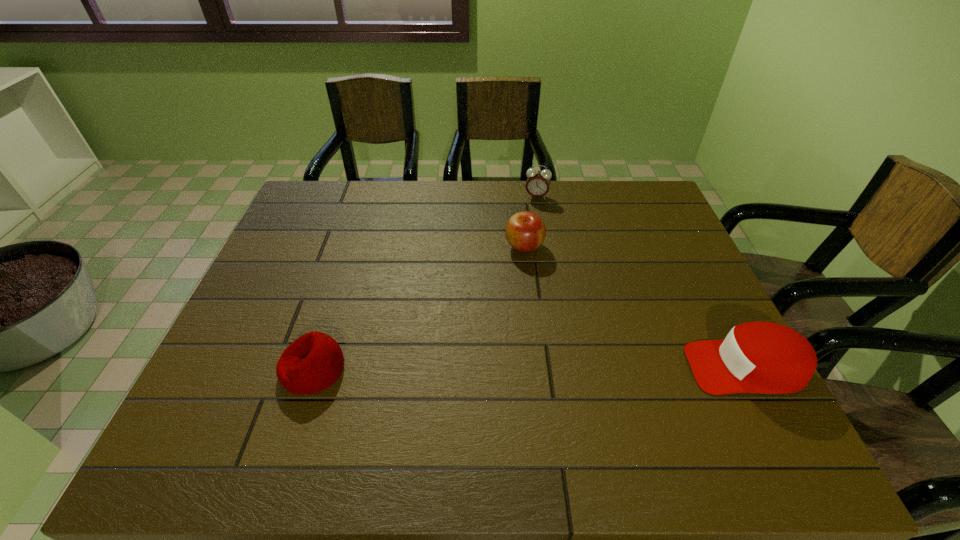
Find the location of `free space located 0.260m on the stem of the apple`. free space located 0.260m on the stem of the apple is located at coordinates (503, 329).

Find the location of a particular element. This screenshot has height=540, width=960. vacant space situated 0.060m on the stem of the apple is located at coordinates (517, 273).

You are a GUI agent. You are given a task and a screenshot of the screen. Output one action in this format:
    pyautogui.click(x=<x>, y=<y>)
    Task: Click on the vacant space located 0.230m on the stem of the apple
    This screenshot has height=540, width=960.
    Given the screenshot: What is the action you would take?
    pyautogui.click(x=506, y=320)

At what (x,y) coordinates should I click in order to perform the action: click on vacant area located on the clock face of the alarm clock. Please return your answer as a coordinate pair (x, y). Image resolution: width=960 pixels, height=540 pixels. Looking at the image, I should click on (525, 247).

Locate an element on the screen. This screenshot has height=540, width=960. vacant space located on the clock face of the alarm clock is located at coordinates (520, 268).

Locate an element on the screen. This screenshot has width=960, height=540. vacant space located 0.270m on the clock face of the alarm clock is located at coordinates (523, 254).

Find the location of a particular element. object situated at the far edge is located at coordinates (538, 182).

You are a GUI agent. You are given a task and a screenshot of the screen. Output one action in this format:
    pyautogui.click(x=<x>, y=<y>)
    Task: Click on the beanbag located in the near edge section of the desktop
    The width and height of the screenshot is (960, 540).
    Given the screenshot: What is the action you would take?
    click(x=313, y=362)

Locate an element on the screen. baseball cap located in the near edge section of the desktop is located at coordinates (755, 357).

You are a GUI agent. You are given a task and a screenshot of the screen. Output one action in this format:
    pyautogui.click(x=<x>, y=<y>)
    Task: Click on the object present at the left edge
    
    Given the screenshot: What is the action you would take?
    pyautogui.click(x=313, y=362)